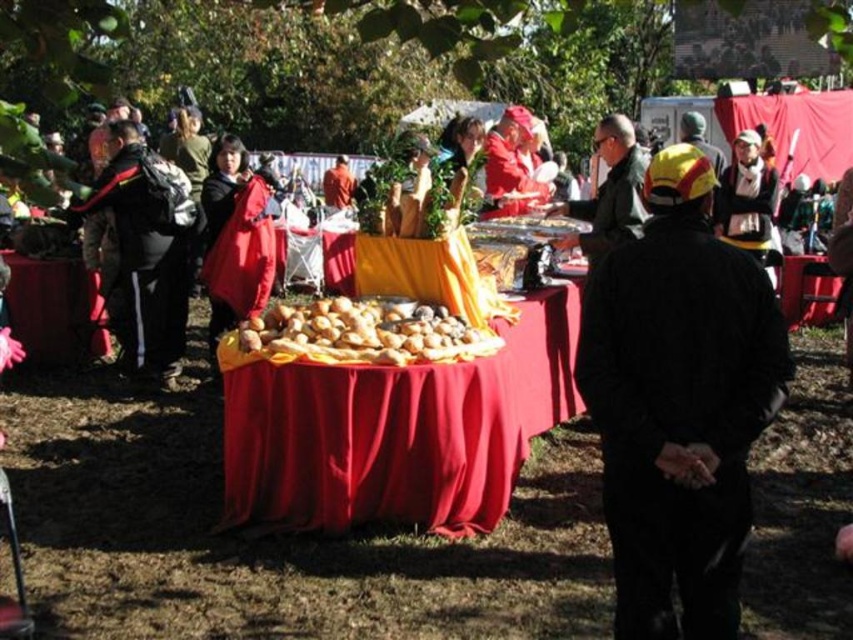
Question: Among these objects, which one is nearest to the camera?

Choices:
 (A) orange fabric at center
 (B) brown matte nuts at center
 (C) black fabric jacket at left

Answer: (B)

Question: Considering the real-world distances, which object is farthest from the matte red coat at center?

Choices:
 (A) black fabric jacket at left
 (B) brown matte nuts at center
 (C) red fabric tablecloth at center

Answer: (B)

Question: Does red cloth-covered table at center appear on the right side of black fabric jacket at left?

Choices:
 (A) no
 (B) yes

Answer: (B)

Question: Does black matte jacket at center come behind red cloth-covered table at center?

Choices:
 (A) yes
 (B) no

Answer: (B)

Question: Which object is positioned farthest from the red fabric tablecloth at center?

Choices:
 (A) black fabric jacket at left
 (B) black matte jacket at center
 (C) matte red coat at center
 (D) orange fabric at center

Answer: (D)

Question: Can you confirm if brown matte nuts at center is positioned to the left of red fabric tablecloth at center?

Choices:
 (A) yes
 (B) no

Answer: (A)